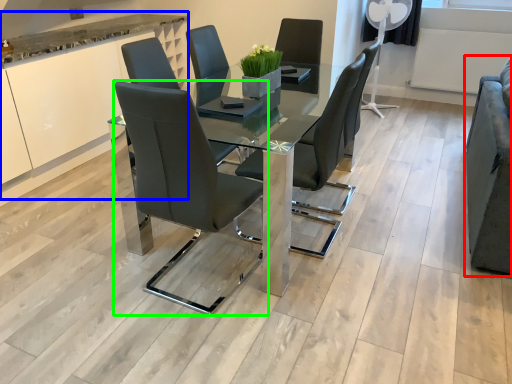
Question: Considering the real-world distances, which object is closest to armchair (highlighted by a red box)? cabinetry (highlighted by a blue box) or chair (highlighted by a green box).

Choices:
 (A) cabinetry
 (B) chair

Answer: (B)